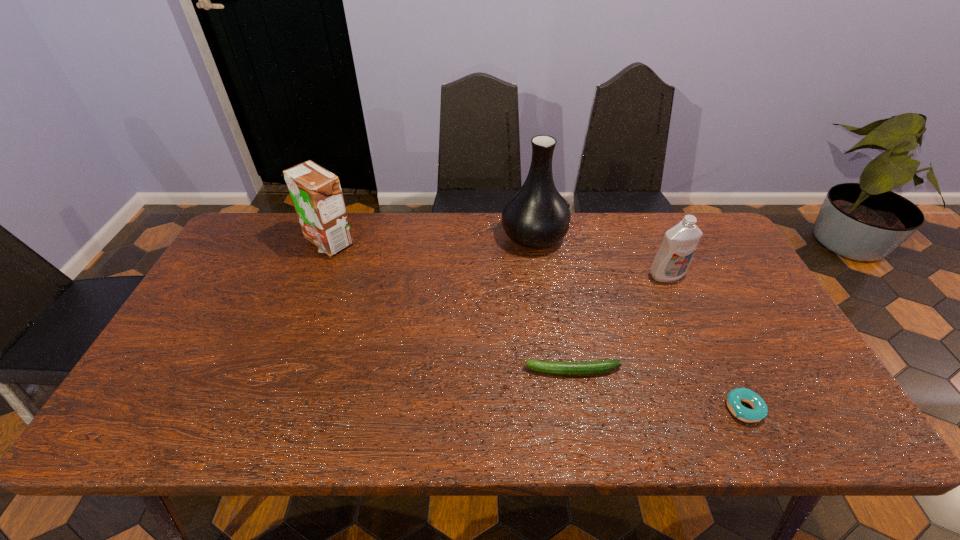
Locate an element on the screen. The image size is (960, 540). vacant space located on the front-facing side of the fourth farthest object is located at coordinates (426, 371).

Locate an element on the screen. This screenshot has height=540, width=960. vacant region located on the front-facing side of the fourth farthest object is located at coordinates (447, 371).

At what (x,y) coordinates should I click in order to perform the action: click on blank area located 0.220m on the back of the doughnut. Please return your answer as a coordinate pair (x, y). The width and height of the screenshot is (960, 540). Looking at the image, I should click on (702, 320).

The image size is (960, 540). I want to click on vase that is at the far edge, so click(x=536, y=216).

Where is `carton that is at the far edge`? This screenshot has width=960, height=540. carton that is at the far edge is located at coordinates (316, 193).

Find the location of a particular element. object at the near edge is located at coordinates (760, 410).

You are a GUI agent. You are given a task and a screenshot of the screen. Output one action in this format:
    pyautogui.click(x=<x>, y=<y>)
    Task: Click on the object at the right edge
    
    Given the screenshot: What is the action you would take?
    pyautogui.click(x=760, y=410)

Find the location of a particular element. This screenshot has height=540, width=960. object that is at the near right corner is located at coordinates (760, 410).

Find the location of a particular element. This screenshot has height=540, width=960. vacant area at the far edge is located at coordinates (632, 245).

This screenshot has width=960, height=540. In the image, there is a desktop. Find the location of `free space at the near edge`. free space at the near edge is located at coordinates (543, 409).